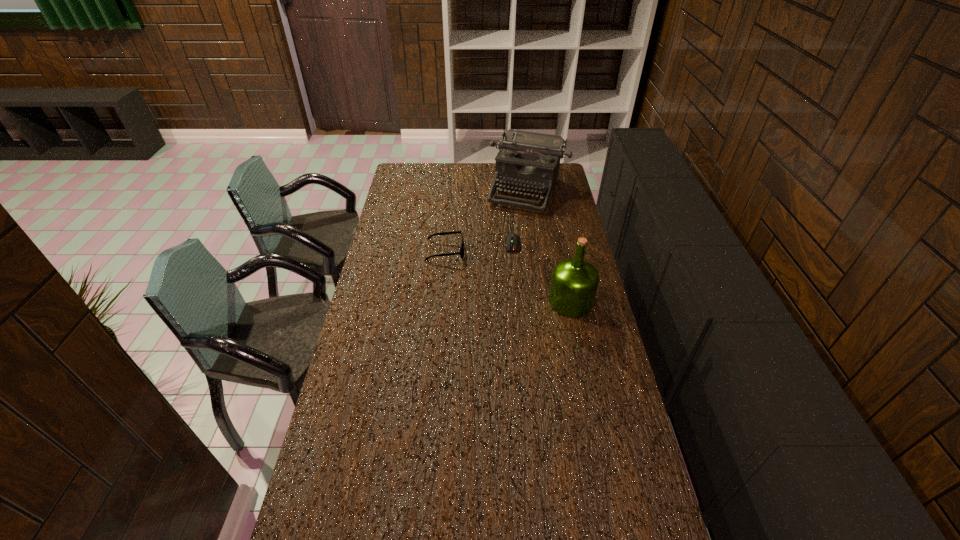
Where is `vacant area situated 0.370m on the typing side of the typewriter`? This screenshot has height=540, width=960. vacant area situated 0.370m on the typing side of the typewriter is located at coordinates (496, 262).

Where is `free space located 0.060m on the typing side of the typewriter`? The height and width of the screenshot is (540, 960). free space located 0.060m on the typing side of the typewriter is located at coordinates point(515,221).

Identify the location of vacant space situated on the button of the shortest object. [x=510, y=306].

Where is `vacant position located on the button of the shortest object`? Image resolution: width=960 pixels, height=540 pixels. vacant position located on the button of the shortest object is located at coordinates (511, 281).

Find the location of a particular element. free space located on the button of the shortest object is located at coordinates (510, 296).

Identify the location of object present at the far edge. This screenshot has width=960, height=540. (530, 161).

Where is `olive oil that is at the right edge`? olive oil that is at the right edge is located at coordinates (574, 283).

Find the location of a particular element. The image size is (960, 540). typewriter that is at the right edge is located at coordinates (530, 161).

Where is `object present at the far right corner`? object present at the far right corner is located at coordinates (530, 161).

Where is `vacant space at the far edge`? This screenshot has height=540, width=960. vacant space at the far edge is located at coordinates (484, 173).